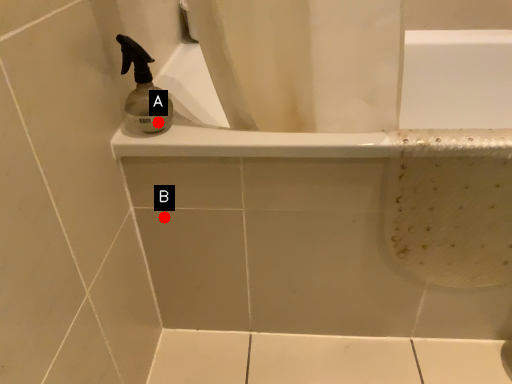
Question: Two points are circled on the image, labeled by A and B beside each circle. Which point is closer to the camera?

Choices:
 (A) A is closer
 (B) B is closer

Answer: (A)